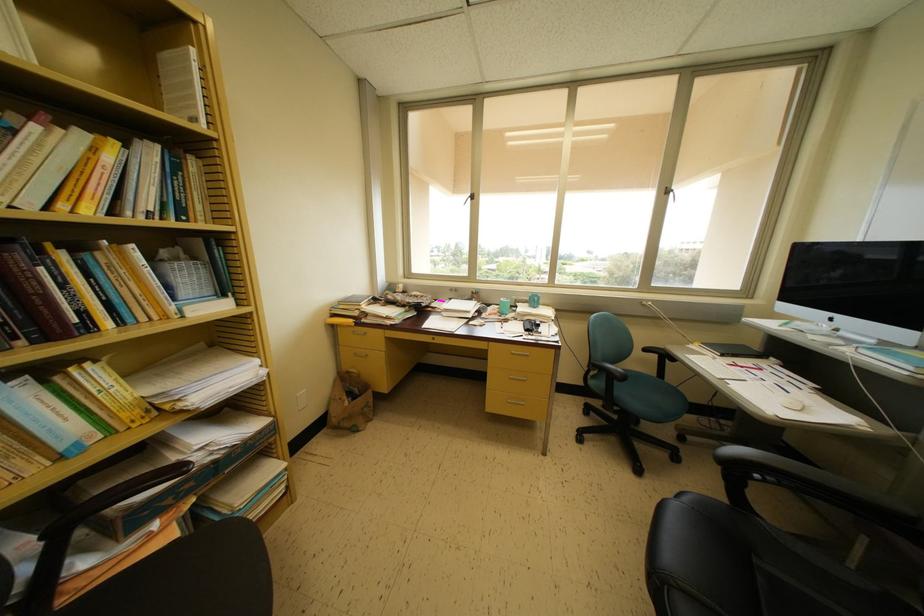
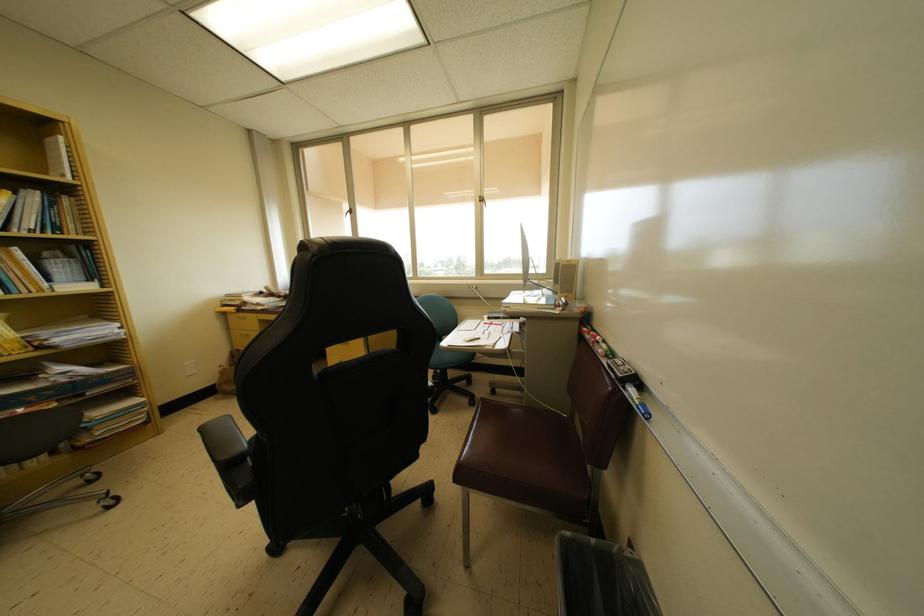
In the second image, find the point that corresponds to the point at 114,164 in the first image.

(7, 206)